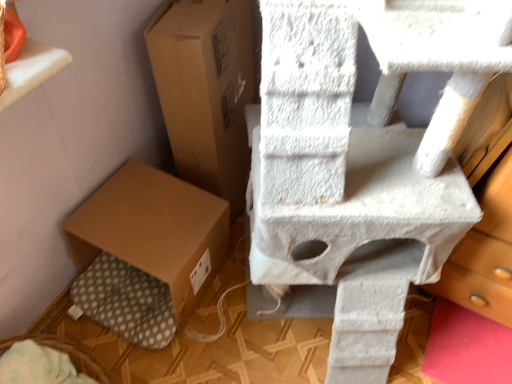
Question: Is brown cardboard box at center, marked as the 2th cardboard box in a bottom-to-top arrangement, turned away from brown cardboard box at lower left, the second cardboard box in the top-to-bottom sequence?

Choices:
 (A) no
 (B) yes

Answer: (A)

Question: Is brown cardboard box at center, marked as the 2th cardboard box in a bottom-to-top arrangement, facing towards brown cardboard box at lower left, the second cardboard box in the top-to-bottom sequence?

Choices:
 (A) no
 (B) yes

Answer: (A)

Question: From a real-world perspective, is brown cardboard box at center, marked as the 2th cardboard box in a bottom-to-top arrangement, physically above brown cardboard box at lower left, arranged as the first cardboard box when ordered from the bottom?

Choices:
 (A) no
 (B) yes

Answer: (B)

Question: From the image's perspective, does brown cardboard box at center, marked as the 2th cardboard box in a bottom-to-top arrangement, appear lower than brown cardboard box at lower left, arranged as the first cardboard box when ordered from the bottom?

Choices:
 (A) yes
 (B) no

Answer: (B)

Question: Can you confirm if brown cardboard box at center, the 1th cardboard box when ordered from top to bottom, is positioned to the left of brown cardboard box at lower left, arranged as the first cardboard box when ordered from the bottom?

Choices:
 (A) no
 (B) yes

Answer: (A)

Question: From the image's perspective, is brown cardboard box at center, marked as the 2th cardboard box in a bottom-to-top arrangement, on brown cardboard box at lower left, arranged as the first cardboard box when ordered from the bottom?

Choices:
 (A) yes
 (B) no

Answer: (A)

Question: From a real-world perspective, is brown cardboard box at lower left, the second cardboard box in the top-to-bottom sequence, physically above brown cardboard box at center, the 1th cardboard box when ordered from top to bottom?

Choices:
 (A) yes
 (B) no

Answer: (B)

Question: Are brown cardboard box at lower left, the second cardboard box in the top-to-bottom sequence, and brown cardboard box at center, the 1th cardboard box when ordered from top to bottom, far apart?

Choices:
 (A) yes
 (B) no

Answer: (B)

Question: Does brown cardboard box at lower left, arranged as the first cardboard box when ordered from the bottom, have a lesser height compared to brown cardboard box at center, marked as the 2th cardboard box in a bottom-to-top arrangement?

Choices:
 (A) no
 (B) yes

Answer: (B)

Question: From the image's perspective, is brown cardboard box at lower left, arranged as the first cardboard box when ordered from the bottom, below brown cardboard box at center, the 1th cardboard box when ordered from top to bottom?

Choices:
 (A) yes
 (B) no

Answer: (A)

Question: Does brown cardboard box at lower left, arranged as the first cardboard box when ordered from the bottom, have a smaller size compared to brown cardboard box at center, the 1th cardboard box when ordered from top to bottom?

Choices:
 (A) no
 (B) yes

Answer: (B)

Question: Would you say brown cardboard box at lower left, arranged as the first cardboard box when ordered from the bottom, contains brown cardboard box at center, marked as the 2th cardboard box in a bottom-to-top arrangement?

Choices:
 (A) no
 (B) yes

Answer: (A)

Question: From a real-world perspective, is white textured cat tree at upper right physically above brown cardboard box at lower left, arranged as the first cardboard box when ordered from the bottom?

Choices:
 (A) yes
 (B) no

Answer: (A)